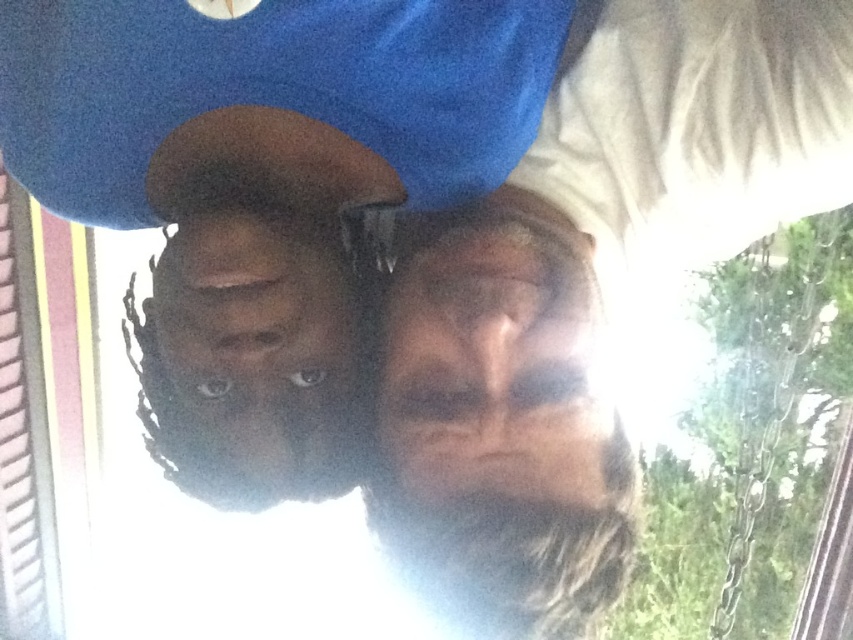
Who is shorter, matte blue shirt at upper center or blue matte cap at upper center?

Standing shorter between the two is blue matte cap at upper center.

Which is behind, point (532, 289) or point (169, 348)?

The point (169, 348) is behind.

Where is `matte blue shirt at upper center`? This screenshot has width=853, height=640. matte blue shirt at upper center is located at coordinates [585, 292].